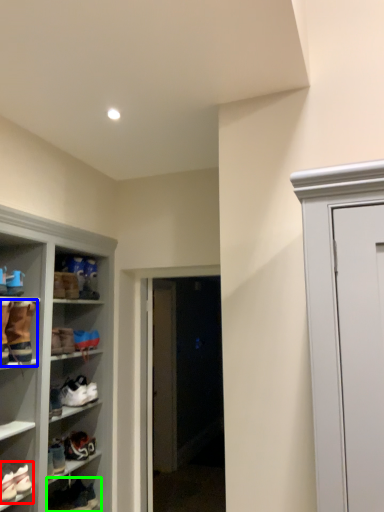
Question: Which object is positioned closest to footwear (highlighted by a red box)? Select from footwear (highlighted by a blue box) and footwear (highlighted by a green box).

Choices:
 (A) footwear
 (B) footwear

Answer: (B)